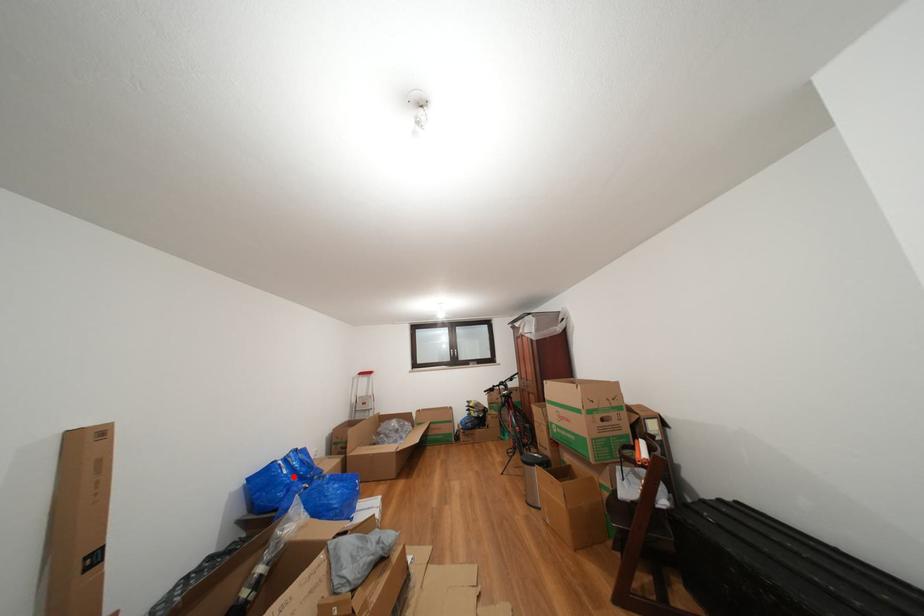
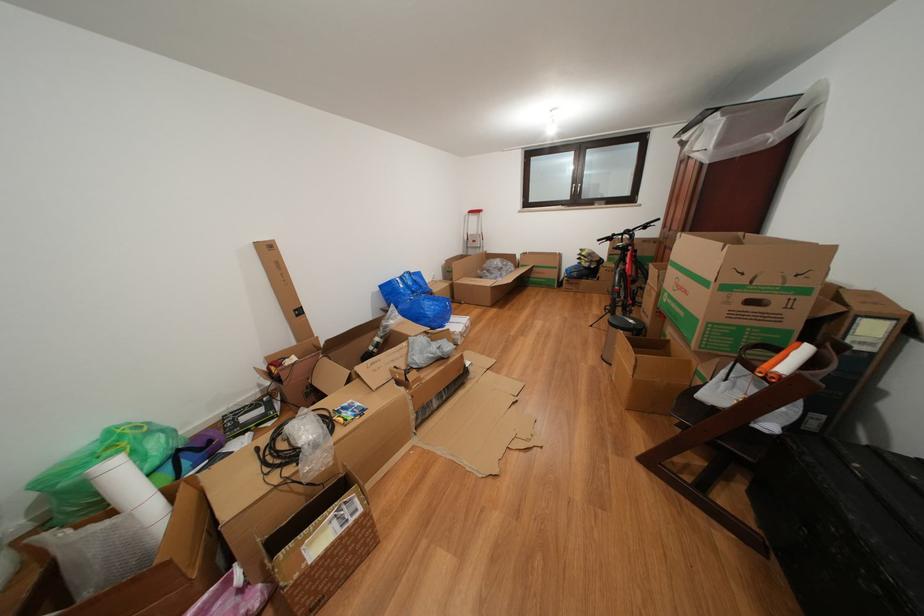
Find the pixel in the second image that matches the highlighted location in the first image.

(409, 291)